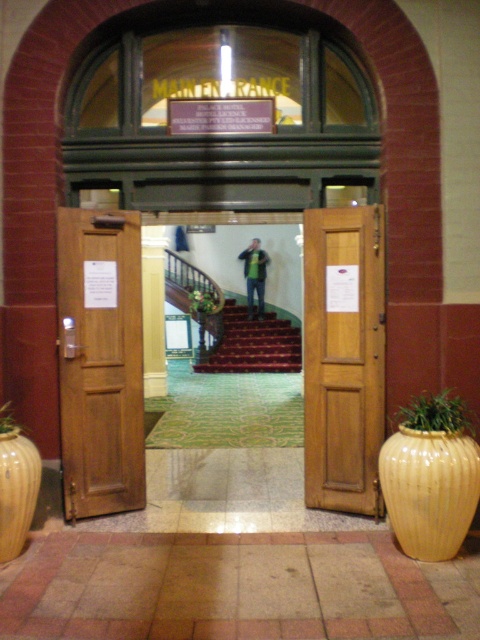
Question: Does wooden door at left appear over green leafy plant at center?

Choices:
 (A) yes
 (B) no

Answer: (B)

Question: Which point appears closest to the camera in this image?

Choices:
 (A) (197, 291)
 (B) (418, 413)
 (C) (352, 216)
 (D) (1, 413)

Answer: (B)

Question: Observing the image, what is the correct spatial positioning of maroon carpeted stairs at center in reference to green matte shirt at center?

Choices:
 (A) below
 (B) above

Answer: (A)

Question: Observing the image, what is the correct spatial positioning of wooden door at left in reference to maroon carpeted stairs at center?

Choices:
 (A) left
 (B) right

Answer: (A)

Question: Estimate the real-world distances between objects in this image. Which object is farther from the green bamboo vase at lower left?

Choices:
 (A) green leafy plant at center
 (B) green textured plant at lower right
 (C) matte yellow vase at right

Answer: (A)

Question: Estimate the real-world distances between objects in this image. Which object is closer to the maroon carpeted stairs at center?

Choices:
 (A) matte yellow vase at left
 (B) green leafy plant at center

Answer: (B)